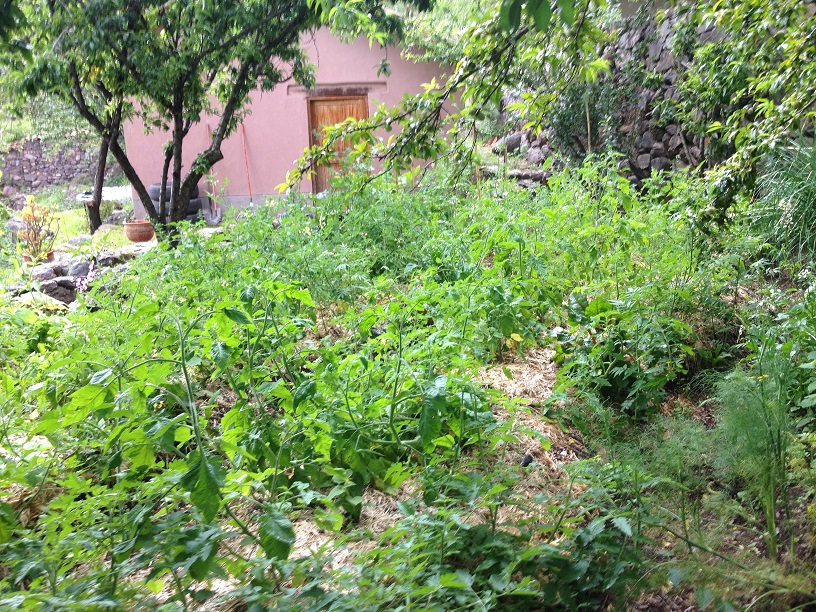
Locate an element on the screen. This screenshot has width=816, height=612. green plant closest to viewer at about the middle of the page is located at coordinates (404, 595).